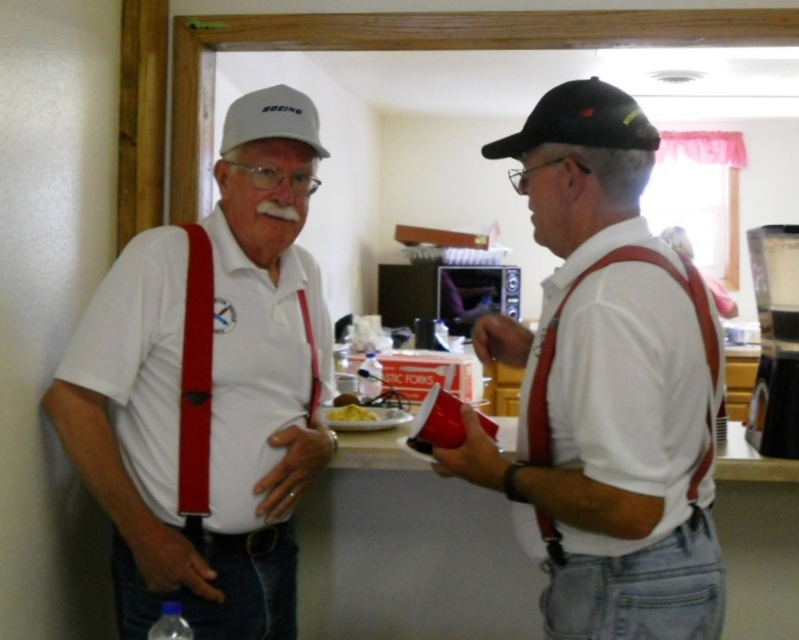
Question: Which point appears farthest from the camera in this image?

Choices:
 (A) (650, 372)
 (B) (499, 147)
 (C) (264, 97)
 (D) (356, 420)

Answer: (D)

Question: Which point is closer to the camera?

Choices:
 (A) matte black cap at upper right
 (B) black plastic coffee machine at right
 (C) yellow matte food at center

Answer: (A)

Question: Which is farther from the yellow matte food at center?

Choices:
 (A) black plastic coffee machine at right
 (B) white matte baseball cap at upper left
 (C) black matte baseball cap at upper right

Answer: (A)

Question: From the image, what is the correct spatial relationship of black matte baseball cap at upper right in relation to yellow matte food at center?

Choices:
 (A) right
 (B) left

Answer: (A)

Question: Is matte black cap at upper right positioned before red leather suspenders at right?

Choices:
 (A) yes
 (B) no

Answer: (A)

Question: Is the position of white matte shirt at center more distant than that of red leather suspenders at right?

Choices:
 (A) no
 (B) yes

Answer: (B)